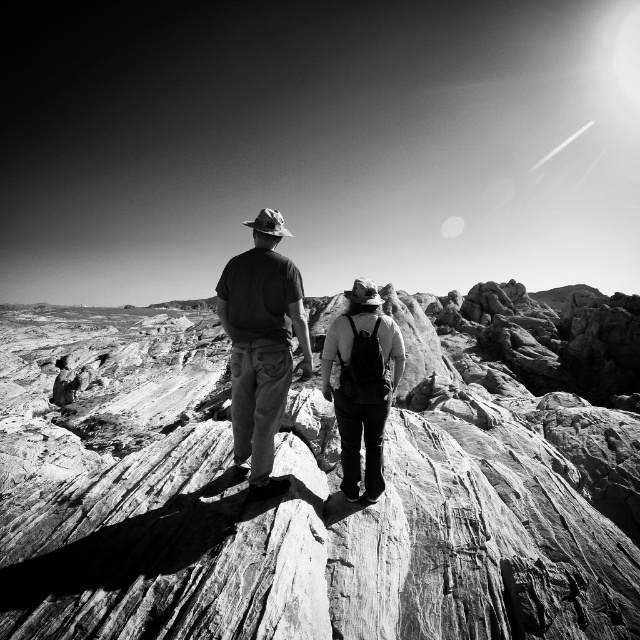
Question: Which point is closer to the camera?

Choices:
 (A) (269, 598)
 (B) (356, 493)

Answer: (A)

Question: Can you confirm if rugged stone rock at center is positioned to the right of dark gray cotton shirt at center?

Choices:
 (A) yes
 (B) no

Answer: (A)

Question: Estimate the real-world distances between objects in this image. Which object is closer to the dark gray cotton shirt at center?

Choices:
 (A) rugged stone rock at center
 (B) matte black backpack at center

Answer: (B)

Question: Where is dark gray cotton shirt at center located in relation to matte black backpack at center in the image?

Choices:
 (A) left
 (B) right

Answer: (A)

Question: Is the position of dark gray cotton shirt at center less distant than that of matte black backpack at center?

Choices:
 (A) no
 (B) yes

Answer: (B)

Question: Estimate the real-world distances between objects in this image. Which object is farther from the dark gray cotton shirt at center?

Choices:
 (A) rugged stone rock at center
 (B) matte black backpack at center

Answer: (A)